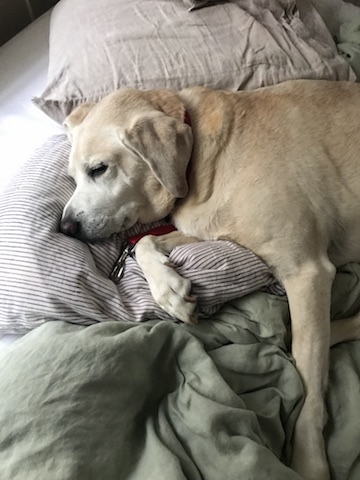
Locate an element on the screen. Image resolution: width=360 pixels, height=480 pixels. stripe pillows is located at coordinates (47, 284), (203, 274).